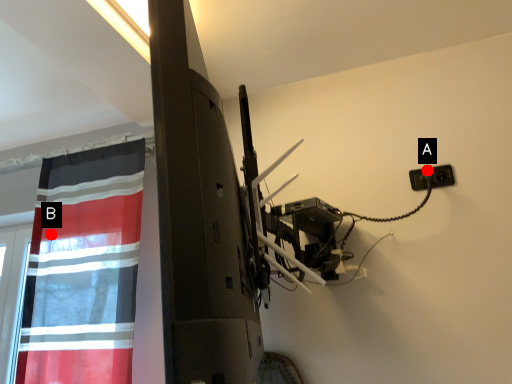
Question: Two points are circled on the image, labeled by A and B beside each circle. Which point is closer to the camera?

Choices:
 (A) A is closer
 (B) B is closer

Answer: (A)